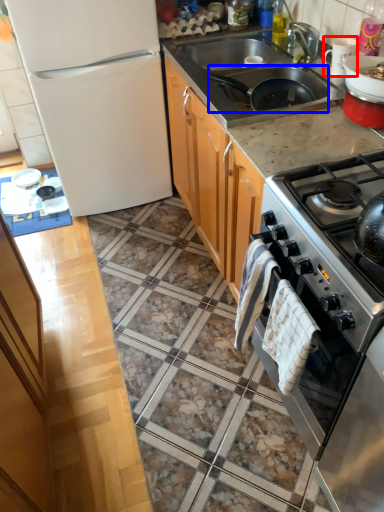
Question: Which point is further to the camera, appliance (highlighted by a red box) or frying pan (highlighted by a blue box)?

Choices:
 (A) appliance
 (B) frying pan

Answer: (A)